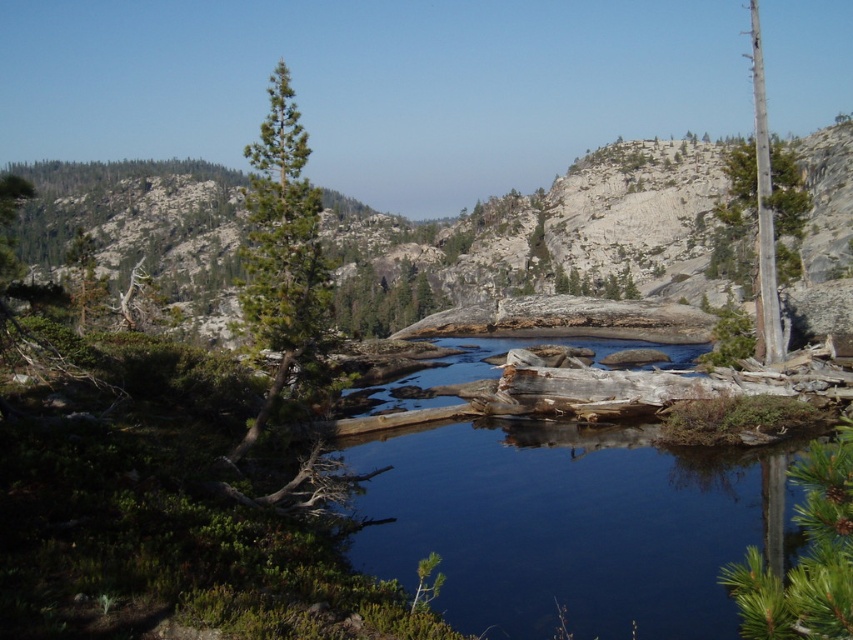
Question: Is green needle-like tree at center-left to the left of green textured tree at center from the viewer's perspective?

Choices:
 (A) yes
 (B) no

Answer: (A)

Question: Which object is farther from the camera taking this photo?

Choices:
 (A) rocky terrain at center
 (B) green needle-like tree at center-left
 (C) green matte tree at lower right

Answer: (A)

Question: Which object appears farthest from the camera in this image?

Choices:
 (A) green matte tree at lower right
 (B) green needle-like tree at center-left
 (C) rocky terrain at center

Answer: (C)

Question: Which point is farther from the camera taking this photo?

Choices:
 (A) (519, 196)
 (B) (395, 278)

Answer: (A)

Question: Can you confirm if rocky terrain at center is positioned above green matte tree at lower right?

Choices:
 (A) no
 (B) yes

Answer: (B)

Question: Can you confirm if rocky terrain at center is thinner than green textured tree at center?

Choices:
 (A) no
 (B) yes

Answer: (A)